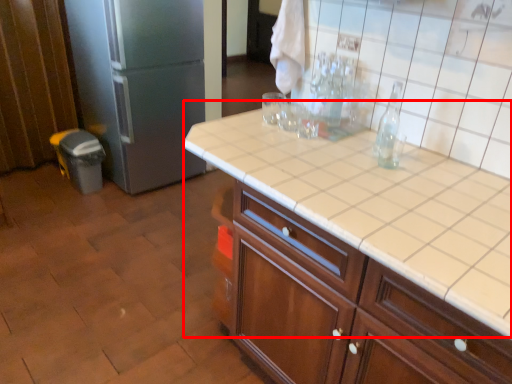
Question: Where is table (annotated by the red box) located in relation to refrigerator in the image?

Choices:
 (A) right
 (B) left

Answer: (A)